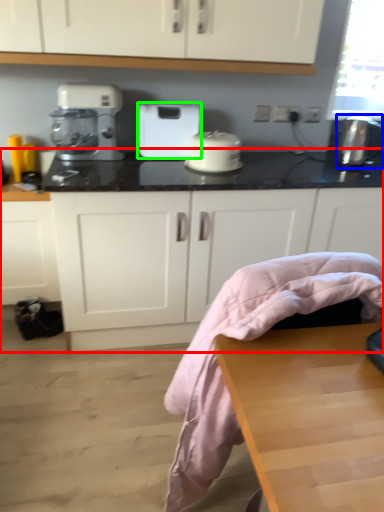
Question: Based on their relative distances, which object is nearer to countertop (highlighted by a red box)? Choose from appliance (highlighted by a blue box) and home appliance (highlighted by a green box).

Choices:
 (A) appliance
 (B) home appliance

Answer: (B)